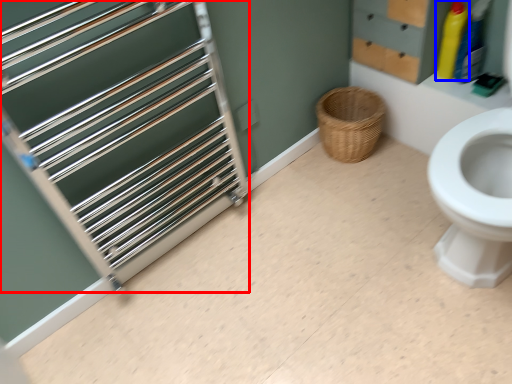
Question: Which of the following is the closest to the observer, cage (highlighted by a red box) or cleaning product (highlighted by a blue box)?

Choices:
 (A) cage
 (B) cleaning product

Answer: (A)